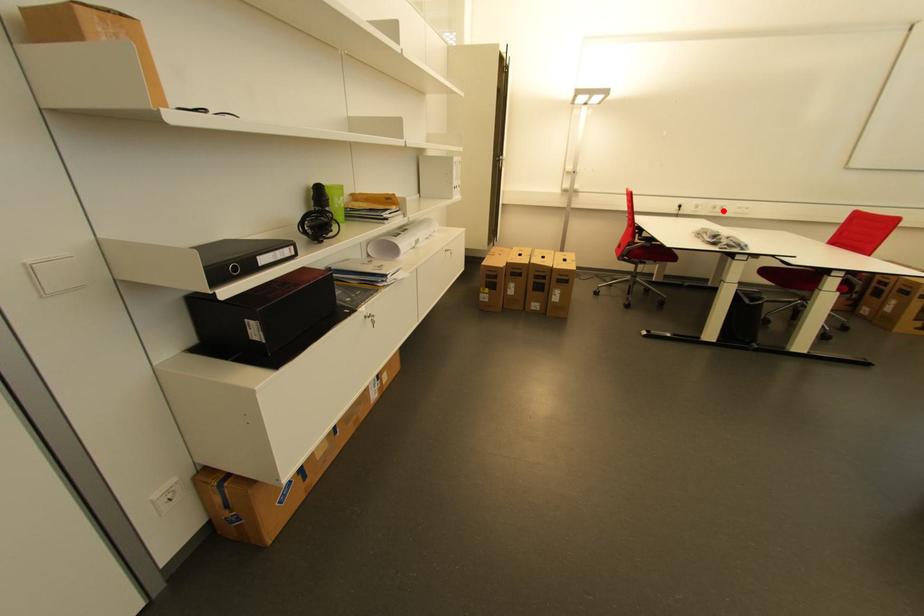
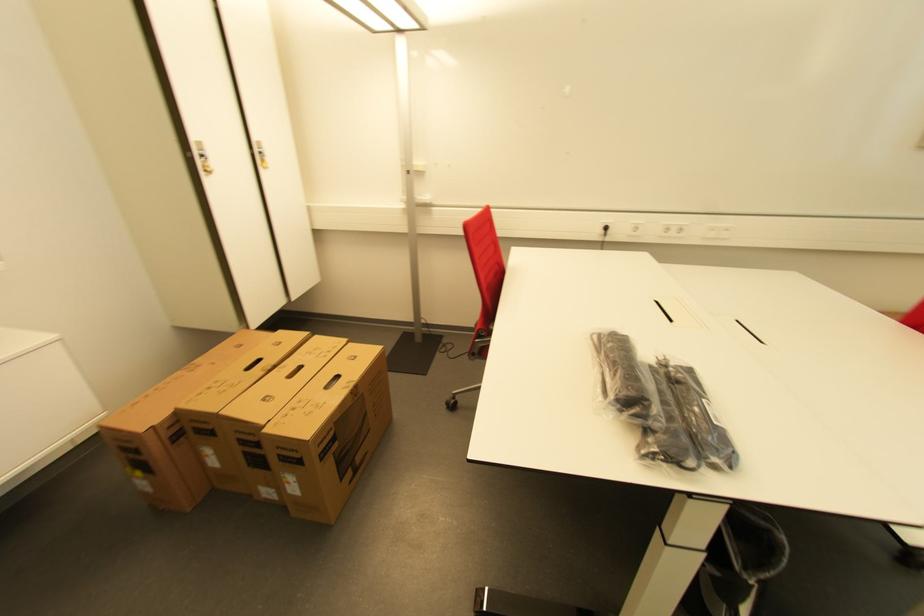
Find the pixel in the second image that matches the highlighted location in the first image.

(676, 233)